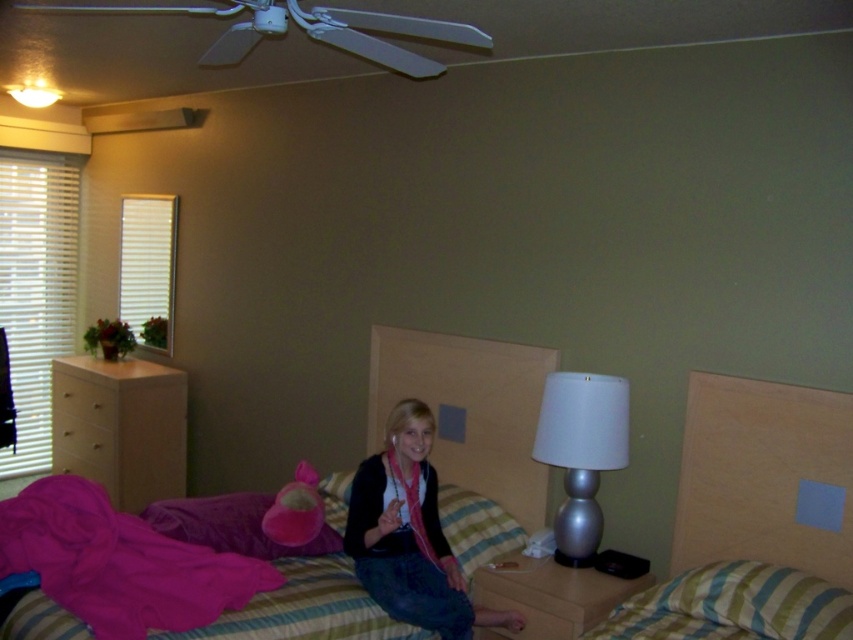
Question: Which object is farther from the camera taking this photo?

Choices:
 (A) striped fabric pillow at center
 (B) striped fabric bed at center

Answer: (B)

Question: Is striped fabric bed at center bigger than wooden dresser at left?

Choices:
 (A) no
 (B) yes

Answer: (A)

Question: Which object is closer to the camera taking this photo?

Choices:
 (A) silver metallic lamp at right
 (B) pink fabric at center
 (C) striped fabric bed at center

Answer: (B)

Question: Among these objects, which one is nearest to the camera?

Choices:
 (A) striped fabric bed at center
 (B) velvet pink blanket at lower left
 (C) silver metallic lamp at right
 (D) pink fabric at center

Answer: (B)

Question: Does wooden dresser at left appear over pink fabric pillow at center?

Choices:
 (A) yes
 (B) no

Answer: (A)

Question: Observing the image, what is the correct spatial positioning of striped fabric pillow at lower right in reference to pink fabric pillow at center?

Choices:
 (A) right
 (B) left

Answer: (A)